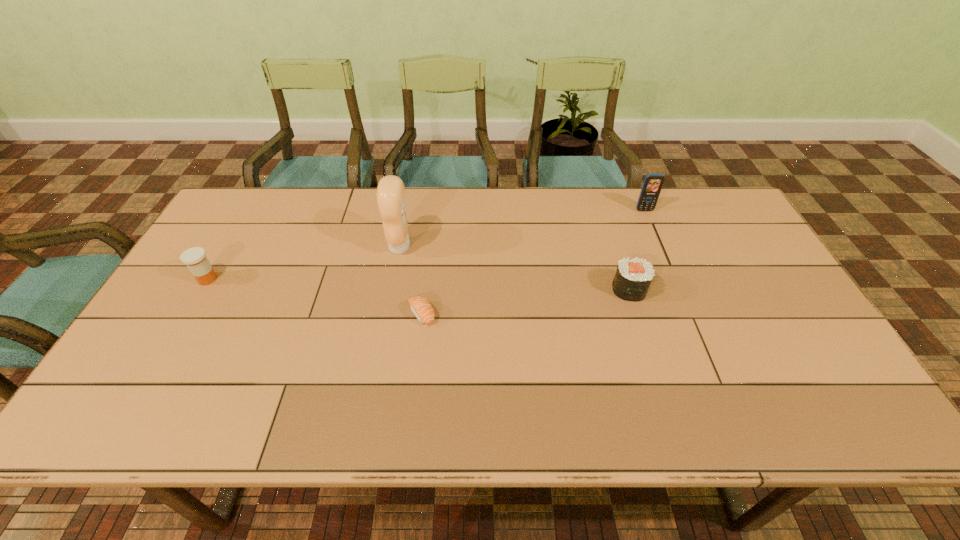
In the image, there is a desktop. At what (x,y) coordinates should I click in order to perform the action: click on free space at the far right corner. Please return your answer as a coordinate pair (x, y). Looking at the image, I should click on (693, 220).

The image size is (960, 540). What are the coordinates of `empty space between the shorter sushi and the cellular telephone` in the screenshot? It's located at (533, 262).

This screenshot has height=540, width=960. In order to click on free space between the tallest object and the medicine in this screenshot , I will do `click(303, 262)`.

Find the location of a particular element. free spot between the shorter sushi and the cellular telephone is located at coordinates (533, 262).

Locate an element on the screen. This screenshot has width=960, height=540. free area in between the second object from left to right and the taller sushi is located at coordinates point(515,268).

Image resolution: width=960 pixels, height=540 pixels. What are the coordinates of `free spot between the fourth object from right to left and the shorter sushi` in the screenshot? It's located at (411, 280).

The image size is (960, 540). Find the location of `blank region between the second object from right to left and the tallest object`. blank region between the second object from right to left and the tallest object is located at coordinates (515, 268).

The height and width of the screenshot is (540, 960). Identify the location of empty space that is in between the right sushi and the second object from left to right. (515, 268).

Locate an element on the screen. This screenshot has height=540, width=960. vacant point located between the taller sushi and the fourth shortest object is located at coordinates (636, 250).

Locate an element on the screen. The width and height of the screenshot is (960, 540). empty space that is in between the cellular telephone and the medicine is located at coordinates (426, 245).